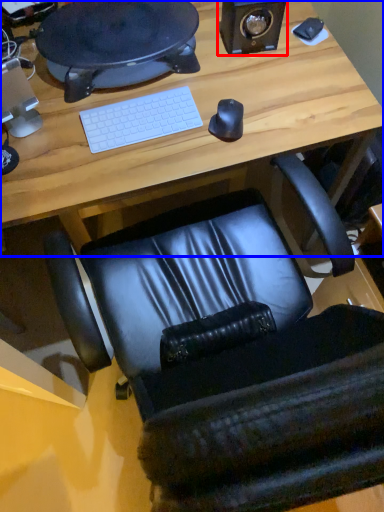
Question: Which point is further to the camera, speaker (highlighted by a red box) or desk (highlighted by a blue box)?

Choices:
 (A) speaker
 (B) desk

Answer: (A)